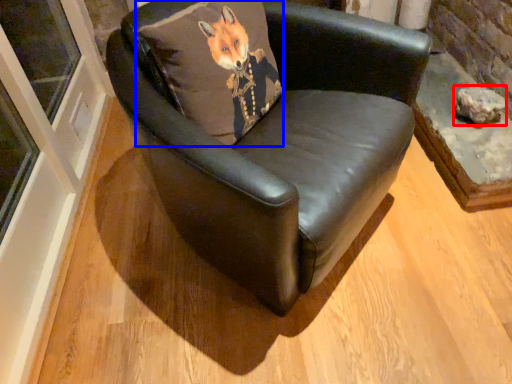
Question: Which object is closer to the camera taking this photo, stone (highlighted by a red box) or pillow (highlighted by a blue box)?

Choices:
 (A) stone
 (B) pillow

Answer: (B)